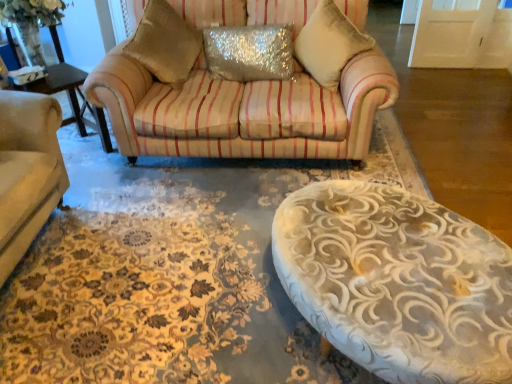
Question: In the image, is velvet beige pillow at upper center, the second pillow positioned from the left, on the left side or the right side of sparkly silver pillow at center, which is the first pillow in left-to-right order?

Choices:
 (A) right
 (B) left

Answer: (A)

Question: Is velvet beige pillow at upper center, the second pillow positioned from the left, bigger or smaller than sparkly silver pillow at center, which is the first pillow in left-to-right order?

Choices:
 (A) small
 (B) big

Answer: (B)

Question: Does point (309, 24) appear closer or farther from the camera than point (234, 72)?

Choices:
 (A) farther
 (B) closer

Answer: (B)

Question: Looking at their shapes, would you say sparkly silver pillow at center, which is the first pillow in left-to-right order, is wider or thinner than velvet beige pillow at upper center, the second pillow positioned from the left?

Choices:
 (A) thin
 (B) wide

Answer: (A)

Question: Considering the relative positions of sparkly silver pillow at center, which is the first pillow in left-to-right order, and velvet beige pillow at upper center, the 1th pillow when ordered from right to left, in the image provided, is sparkly silver pillow at center, which is the first pillow in left-to-right order, to the left or to the right of velvet beige pillow at upper center, the 1th pillow when ordered from right to left,?

Choices:
 (A) left
 (B) right

Answer: (A)

Question: Is sparkly silver pillow at center, which is the first pillow in left-to-right order, inside or outside of velvet beige pillow at upper center, the second pillow positioned from the left?

Choices:
 (A) outside
 (B) inside

Answer: (A)

Question: Does point (215, 72) appear closer or farther from the camera than point (348, 24)?

Choices:
 (A) closer
 (B) farther

Answer: (B)